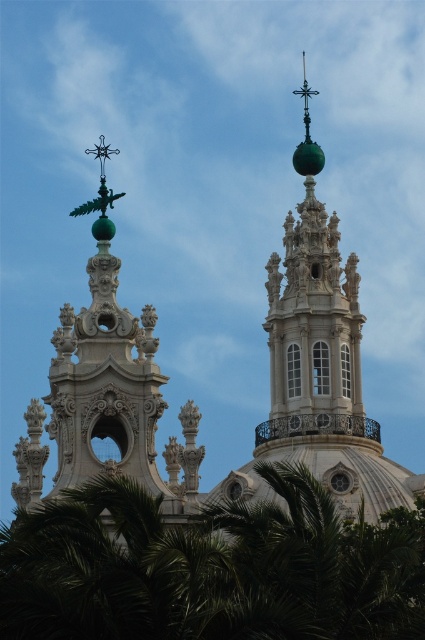
The image size is (425, 640). Describe the element at coordinates (210, 568) in the screenshot. I see `green leafy tree at lower left` at that location.

Is green leafy tree at lower left above green polished dome at upper left?

No, green leafy tree at lower left is not above green polished dome at upper left.

Where is `green leafy tree at lower left`? This screenshot has height=640, width=425. green leafy tree at lower left is located at coordinates (210, 568).